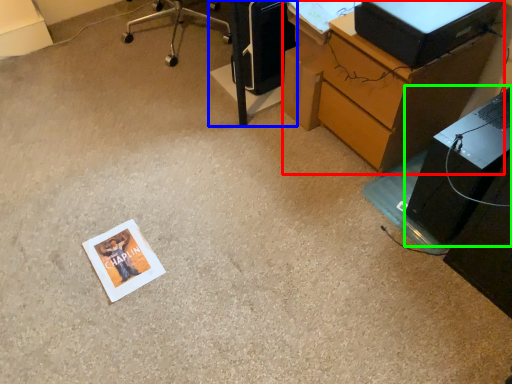
Question: Estimate the real-world distances between objects in this image. Which object is closer to desk (highlighted by a red box), furniture (highlighted by a blue box) or computer tower (highlighted by a green box)?

Choices:
 (A) furniture
 (B) computer tower

Answer: (B)